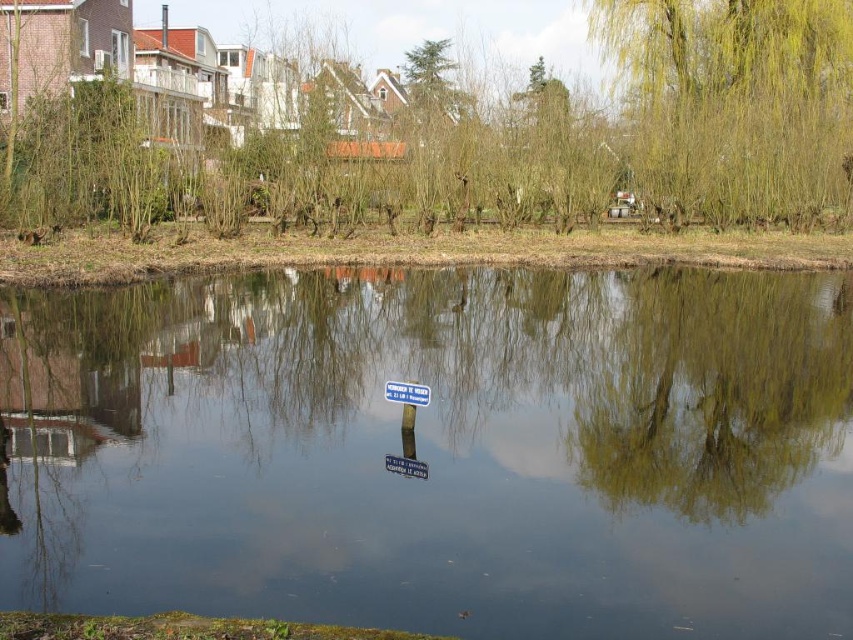
You are standing at the edge of the water and see two points marked in the image. The first point is at coordinate point (292, 531) and the second is at point (643, 77). Which point is closer to you?

Point (292, 531) is in front of point (643, 77), so it is closer to you.

Looking at the image, which of the two trees, the green leafy tree at upper center or the green willow tree at upper right, has a larger size?

The green leafy tree at upper center is bigger than the green willow tree at upper right.